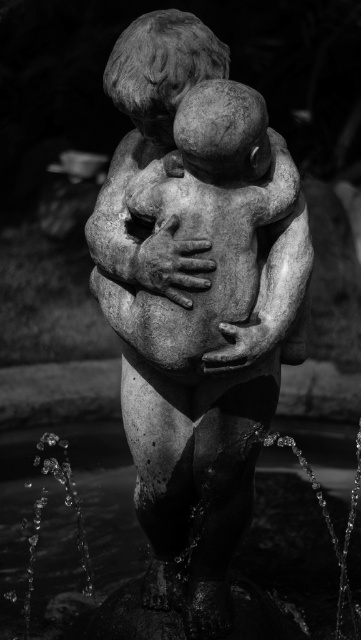
Looking at the fountain in the photograph, where is the stone statue at center in relation to the sparkling water at statue center?

The stone statue at center is to the right of the sparkling water at statue center.

You are an art conservator assessing the fountain structure. You need to determine which object is smaller between the stone statue at center and the sparkling water at statue center. Which one is smaller?

The stone statue at center is smaller compared to the sparkling water at statue center according to the description.